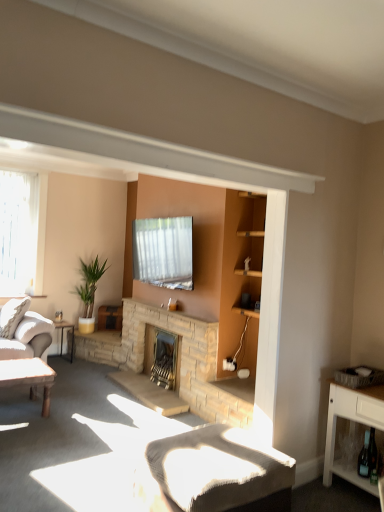
Question: Should I look upward or downward to see wooden table at lower left, the first table when ordered from front to back?

Choices:
 (A) down
 (B) up

Answer: (A)

Question: Is white textured cushion at lower center with metallic silver table at left, marked as the 1th table in a back-to-front arrangement?

Choices:
 (A) no
 (B) yes

Answer: (A)

Question: Is white textured cushion at lower center looking in the opposite direction of metallic silver table at left, marked as the 1th table in a back-to-front arrangement?

Choices:
 (A) yes
 (B) no

Answer: (B)

Question: From the image's perspective, is white textured cushion at lower center on top of metallic silver table at left, marked as the 1th table in a back-to-front arrangement?

Choices:
 (A) yes
 (B) no

Answer: (B)

Question: Considering the relative sizes of white textured cushion at lower center and metallic silver table at left, arranged as the second table when viewed from the front, in the image provided, is white textured cushion at lower center bigger than metallic silver table at left, arranged as the second table when viewed from the front,?

Choices:
 (A) no
 (B) yes

Answer: (B)

Question: From a real-world perspective, is white textured cushion at lower center on top of metallic silver table at left, arranged as the second table when viewed from the front?

Choices:
 (A) yes
 (B) no

Answer: (B)

Question: Does white textured cushion at lower center lie in front of metallic silver table at left, marked as the 1th table in a back-to-front arrangement?

Choices:
 (A) no
 (B) yes

Answer: (B)

Question: Are green leafy plant in pot at left and white textured cushion at lower center making contact?

Choices:
 (A) no
 (B) yes

Answer: (A)

Question: From the image's perspective, does green leafy plant in pot at left appear lower than white textured cushion at lower center?

Choices:
 (A) no
 (B) yes

Answer: (A)

Question: Is green leafy plant in pot at left facing towards white textured cushion at lower center?

Choices:
 (A) yes
 (B) no

Answer: (A)

Question: Does green leafy plant in pot at left have a smaller size compared to white textured cushion at lower center?

Choices:
 (A) yes
 (B) no

Answer: (B)

Question: From a real-world perspective, is green leafy plant in pot at left located higher than white textured cushion at lower center?

Choices:
 (A) yes
 (B) no

Answer: (A)

Question: From a real-world perspective, is green leafy plant in pot at left below white textured cushion at lower center?

Choices:
 (A) no
 (B) yes

Answer: (A)

Question: Does clear glass window at left have a smaller size compared to metallic silver table at left, arranged as the second table when viewed from the front?

Choices:
 (A) no
 (B) yes

Answer: (A)